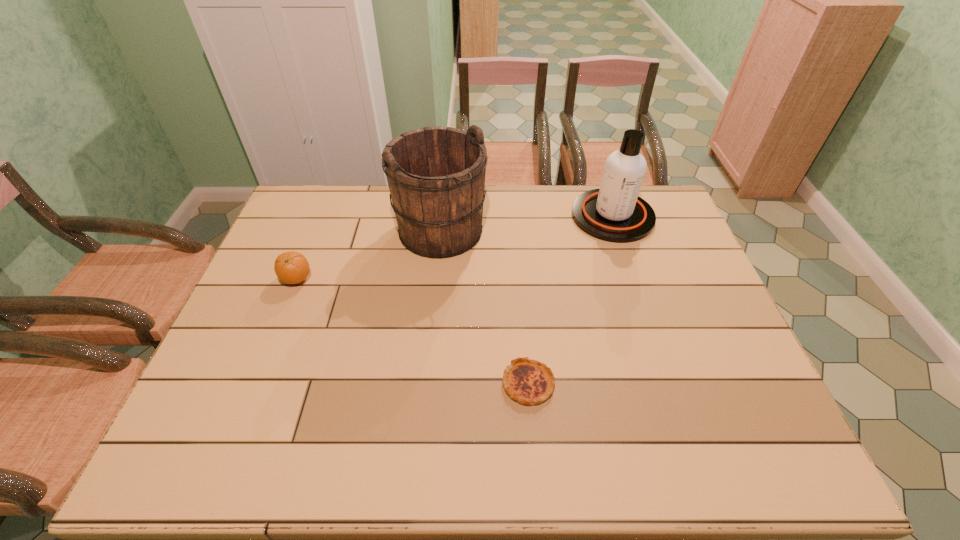
Find the location of a particular element. This screenshot has height=540, width=960. vacant space that satisfies the following two spatial constraints: 1. on the back side of the nearest object; 2. on the left side of the rightmost object is located at coordinates (514, 216).

The height and width of the screenshot is (540, 960). Find the location of `blank space that satisfies the following two spatial constraints: 1. on the front side of the second object from right to left; 2. on the left side of the third tallest object`. blank space that satisfies the following two spatial constraints: 1. on the front side of the second object from right to left; 2. on the left side of the third tallest object is located at coordinates (255, 383).